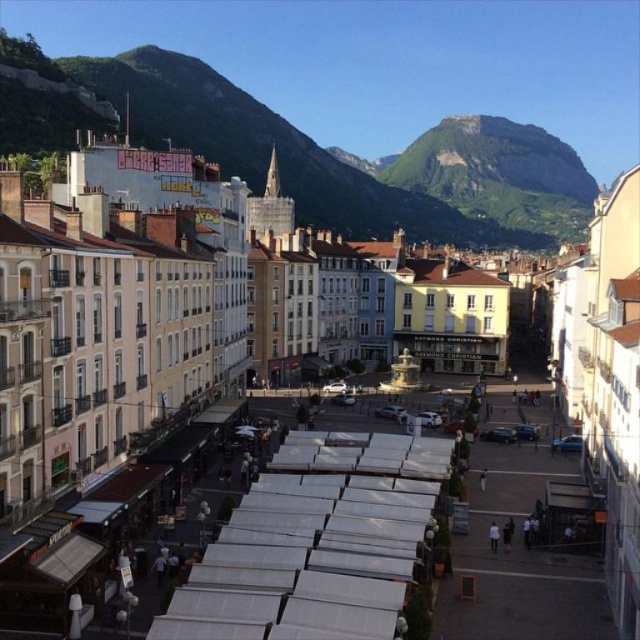
Question: Which of the following is the farthest from the observer?

Choices:
 (A) rocky brown mountain at upper center
 (B) green rock mountain at upper center

Answer: (B)

Question: Which of the following is the farthest from the observer?

Choices:
 (A) (454, 124)
 (B) (465, 122)

Answer: (A)

Question: In this image, where is rocky brown mountain at upper center located relative to green rock mountain at upper center?

Choices:
 (A) below
 (B) above

Answer: (A)

Question: Is rocky brown mountain at upper center above green rock mountain at upper center?

Choices:
 (A) no
 (B) yes

Answer: (A)

Question: Is rocky brown mountain at upper center to the left of green rock mountain at upper center from the viewer's perspective?

Choices:
 (A) yes
 (B) no

Answer: (A)